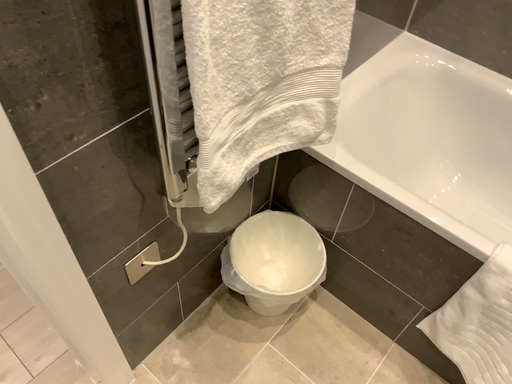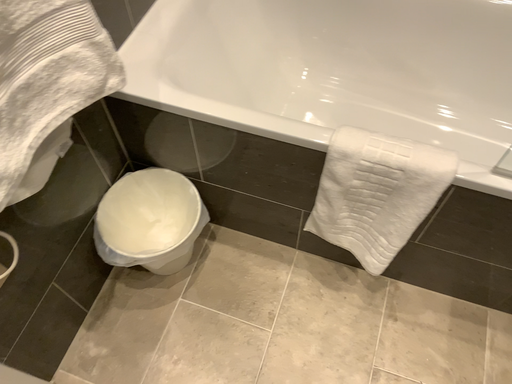
Question: How did the camera likely rotate when shooting the video?

Choices:
 (A) rotated left
 (B) rotated right

Answer: (B)